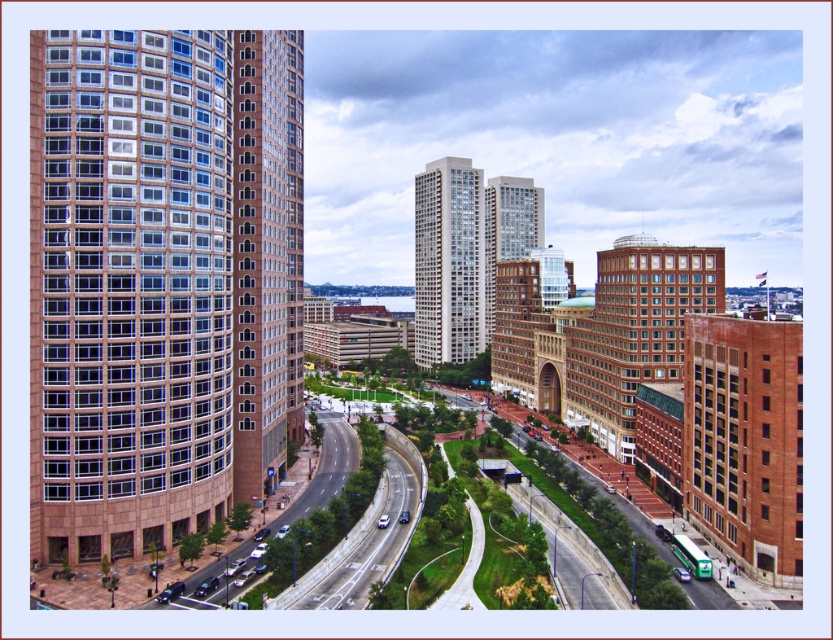
You are a city planner analyzing the urban layout. Considering the brown brick building at left and the asphalt road at center, which one occupies more space in the image?

The brown brick building at left has a larger size compared to the asphalt road at center, so it occupies more space in the image.

From the picture: You are a drone operator trying to navigate between the brown glassy building at left and the brick textured building at center right. Which building is closer to your current position if you are positioned between them?

The brown glassy building at left is closer to your current position because it is in front of the brick textured building at center right.

You are a delivery driver trying to navigate through the city. You see the brown brick building at left and the asphalt road at center. Which one is closer to your current position?

The brown brick building at left is closer to your current position because the asphalt road at center is behind it.